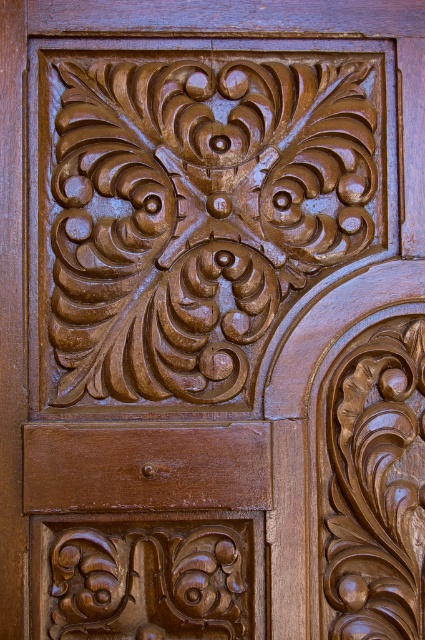
In the scene shown: What are the coordinates of the brown carved wood at center in the image?

The coordinates of the brown carved wood at center are at point (x=197, y=216).

You are an art conservator examining the carved wooden panels. You notice two points marked on the central panel. One is at coordinate point [161,81] and the other at point [115,586]. Which of these points is closer to the surface of the panel that you are observing?

Point [161,81] is further to the camera than point [115,586], so the point closer to the surface you are observing is point [115,586].

Based on the photo, you are an interior designer assessing the wooden panels in the image. You need to determine which object takes up more space visually. Which one is bigger between the brown carved wood at center and the matte brown wood at lower center?

→ The brown carved wood at center is larger in size than the matte brown wood at lower center, so it takes up more visual space.